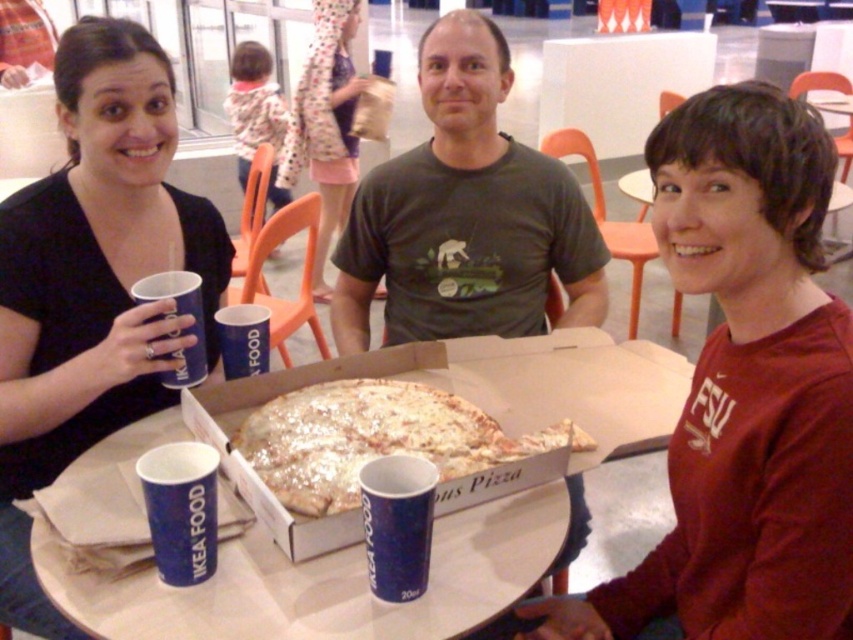
Question: Which is farther from the blue paper cup at lower center?

Choices:
 (A) blue paper cup at center
 (B) polka dot dress at center
 (C) white paper table at center
 (D) white cheese pizza at center

Answer: (B)

Question: Does polka dot dress at center come behind blue paper cup at upper left?

Choices:
 (A) yes
 (B) no

Answer: (A)

Question: Can you confirm if blue paper cup at lower center is thinner than blue paper cup at center?

Choices:
 (A) yes
 (B) no

Answer: (A)

Question: Can you confirm if blue paper cup at lower left is positioned to the left of blue paper cup at center?

Choices:
 (A) no
 (B) yes

Answer: (A)

Question: Which point appears closest to the camera in this image?

Choices:
 (A) (73, 584)
 (B) (164, 380)
 (C) (26, 570)

Answer: (A)

Question: Estimate the real-world distances between objects in this image. Which object is closer to the blue paper cup at lower center?

Choices:
 (A) blue paper cup at upper left
 (B) blue paper cup at center
 (C) white cheese pizza at center
 (D) matte black shirt at upper left

Answer: (C)